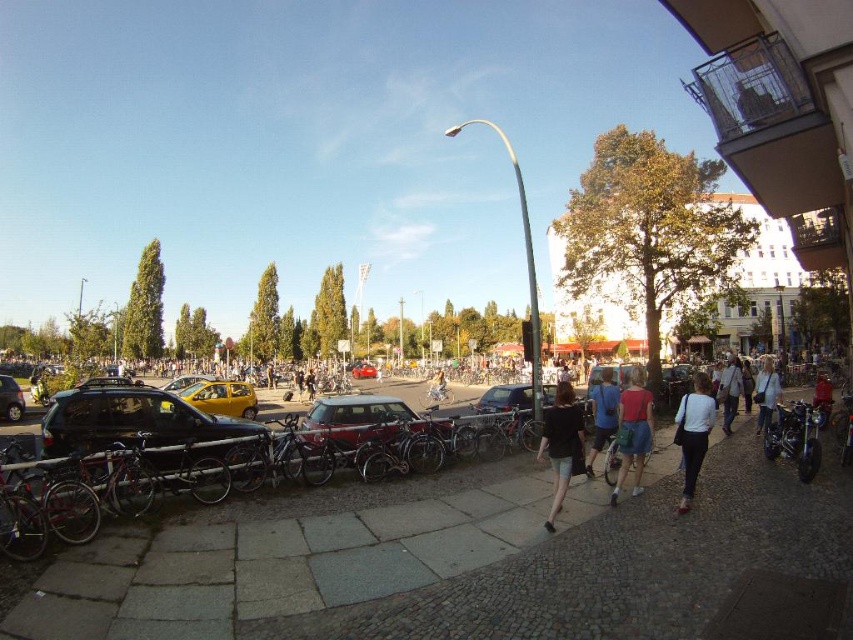
Question: Can you confirm if black cotton shirt at center is positioned to the left of matte black car at center?

Choices:
 (A) yes
 (B) no

Answer: (B)

Question: Which point is closer to the camera?

Choices:
 (A) shiny black suv at center-left
 (B) black cotton shirt at center
 (C) matte black car at left
 (D) red leather jacket at lower right

Answer: (B)

Question: Which of the following is the closest to the observer?

Choices:
 (A) (386, 444)
 (B) (59, 484)
 (C) (103, 422)

Answer: (B)

Question: Which point is closer to the camera?

Choices:
 (A) click(775, 401)
 (B) click(701, 458)
 (C) click(573, 456)

Answer: (C)

Question: Where is matte pink shirt at center located in relation to yellow matte car at center in the image?

Choices:
 (A) below
 (B) above

Answer: (B)

Question: Does shiny metallic car at center have a greater width compared to denim shorts at center?

Choices:
 (A) no
 (B) yes

Answer: (B)